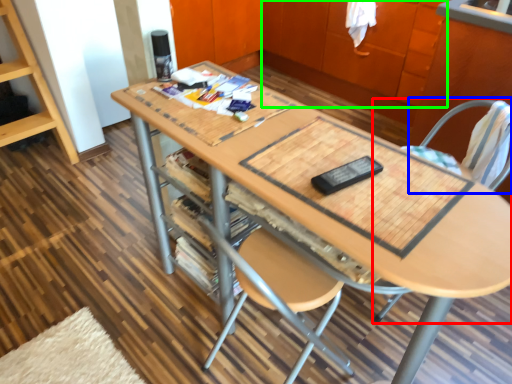
Question: Which object is positioned farthest from chair (highlighted by a red box)? Select from swivel chair (highlighted by a blue box) and cabinetry (highlighted by a green box).

Choices:
 (A) swivel chair
 (B) cabinetry

Answer: (B)